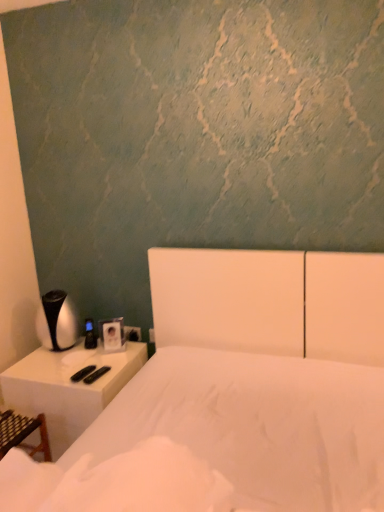
Question: Could you tell me if white matte bed at center is turned towards white plastic electric outlet at lower center?

Choices:
 (A) yes
 (B) no

Answer: (B)

Question: From a real-world perspective, is white matte bed at center positioned under white plastic electric outlet at lower center based on gravity?

Choices:
 (A) yes
 (B) no

Answer: (B)

Question: Is white matte bed at center in contact with white plastic electric outlet at lower center?

Choices:
 (A) no
 (B) yes

Answer: (A)

Question: Is white matte bed at center wider than white plastic electric outlet at lower center?

Choices:
 (A) yes
 (B) no

Answer: (A)

Question: Is the position of white matte bed at center less distant than that of white plastic electric outlet at lower center?

Choices:
 (A) yes
 (B) no

Answer: (A)

Question: From their relative heights in the image, would you say white matte bed at center is taller or shorter than white plastic electric outlet at lower center?

Choices:
 (A) short
 (B) tall

Answer: (B)

Question: Is white matte bed at center wider or thinner than white plastic electric outlet at lower center?

Choices:
 (A) thin
 (B) wide

Answer: (B)

Question: In terms of size, does white matte bed at center appear bigger or smaller than white plastic electric outlet at lower center?

Choices:
 (A) big
 (B) small

Answer: (A)

Question: Which is correct: white matte bed at center is inside white plastic electric outlet at lower center, or outside of it?

Choices:
 (A) outside
 (B) inside

Answer: (A)

Question: Looking at the image, does white plastic electric outlet at lower center seem bigger or smaller compared to white matte bed at center?

Choices:
 (A) small
 (B) big

Answer: (A)

Question: Considering their positions, is white plastic electric outlet at lower center located in front of or behind white matte bed at center?

Choices:
 (A) front
 (B) behind

Answer: (B)

Question: Is white plastic electric outlet at lower center taller or shorter than white matte bed at center?

Choices:
 (A) tall
 (B) short

Answer: (B)

Question: From a real-world perspective, relative to white matte bed at center, is white plastic electric outlet at lower center vertically above or below?

Choices:
 (A) above
 (B) below

Answer: (B)

Question: Visually, is white plastic nightstand at left positioned to the left or to the right of white matte bed at center?

Choices:
 (A) right
 (B) left

Answer: (B)

Question: Considering their positions, is white plastic nightstand at left located in front of or behind white matte bed at center?

Choices:
 (A) front
 (B) behind

Answer: (B)